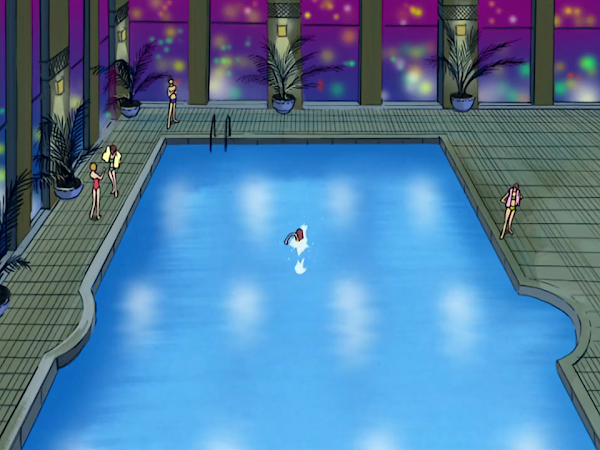
The height and width of the screenshot is (450, 600). I want to click on lights, so click(462, 32), click(281, 31), click(124, 36), click(61, 84).